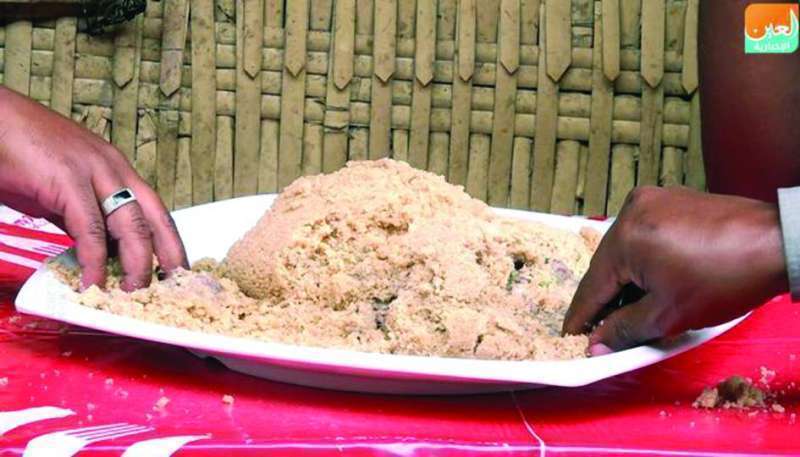
Identify the location of edge of table. The image size is (800, 457). (462, 449).